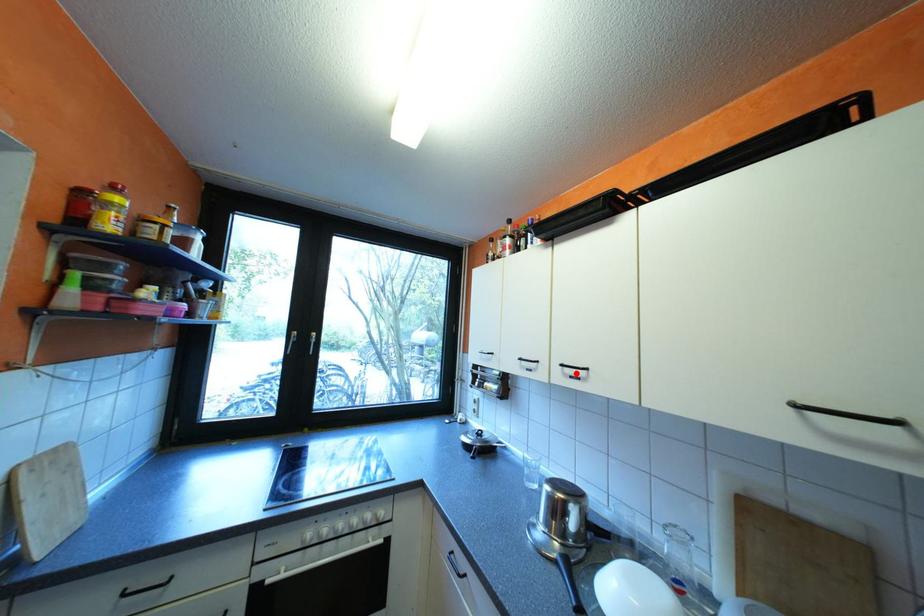
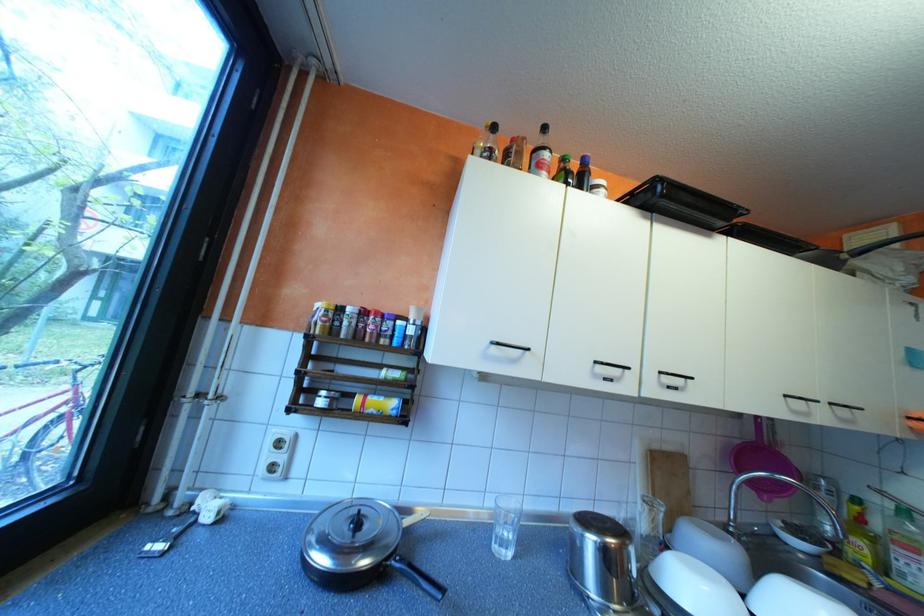
Find the pixel in the second image that matches the highlighted location in the first image.

(673, 383)